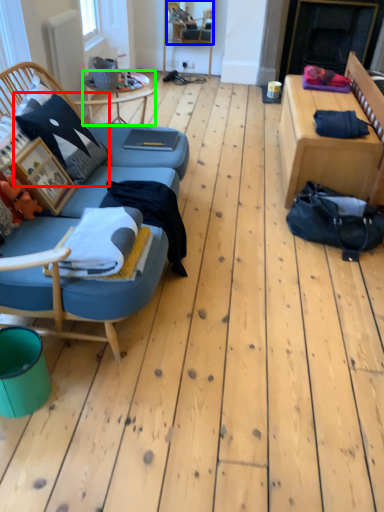
Question: Based on their relative distances, which object is nearer to pillow (highlighted by a red box)? Choose from chair (highlighted by a blue box) and table (highlighted by a green box).

Choices:
 (A) chair
 (B) table

Answer: (B)